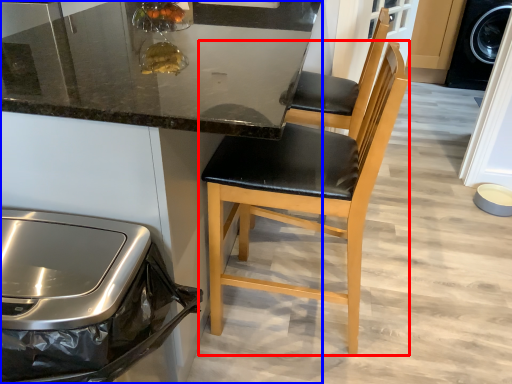
Question: Which point is closer to the camera, chair (highlighted by a red box) or cabinetry (highlighted by a blue box)?

Choices:
 (A) chair
 (B) cabinetry

Answer: (B)